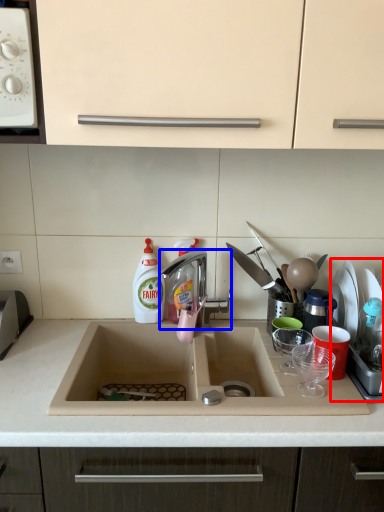
Question: Which object appears farthest to the camera in this image, appliance (highlighted by a red box) or tap (highlighted by a blue box)?

Choices:
 (A) appliance
 (B) tap

Answer: (B)